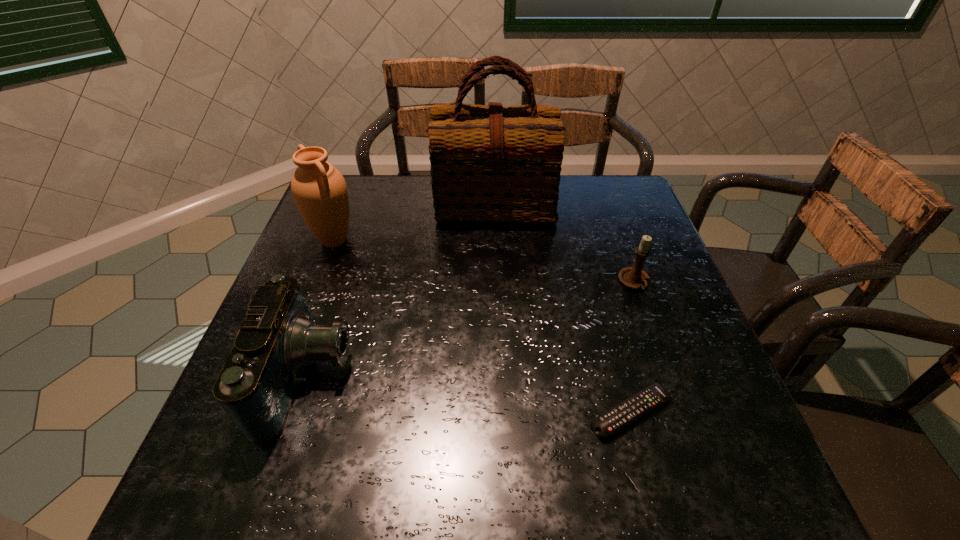
Identify the location of shopping bag. The image size is (960, 540). (493, 163).

What are the coordinates of `urn` in the screenshot? It's located at (319, 190).

Where is `the third shortest object`? The width and height of the screenshot is (960, 540). the third shortest object is located at coordinates (257, 385).

The width and height of the screenshot is (960, 540). I want to click on the third farthest object, so click(634, 277).

The height and width of the screenshot is (540, 960). I want to click on candle holder, so pos(634,277).

This screenshot has height=540, width=960. What are the coordinates of `remote control` in the screenshot? It's located at (608, 423).

Locate an element on the screen. This screenshot has height=540, width=960. vacant space situated 0.070m on the open handle side of the tallest object is located at coordinates (495, 248).

Where is `vacant space located on the front of the urn`? The width and height of the screenshot is (960, 540). vacant space located on the front of the urn is located at coordinates (315, 293).

The image size is (960, 540). I want to click on vacant point located on the front-facing side of the third shortest object, so click(x=533, y=377).

Where is `free space located 0.400m on the side of the third nearest object with the handle`? The height and width of the screenshot is (540, 960). free space located 0.400m on the side of the third nearest object with the handle is located at coordinates (701, 471).